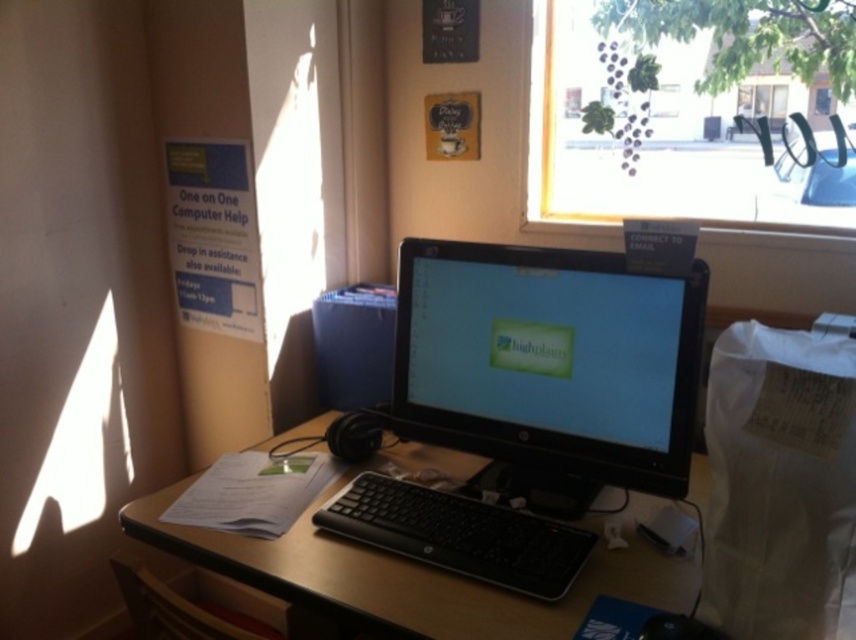
Who is positioned more to the left, black plastic monitor at center or transparent glass window at upper right?

Positioned to the left is black plastic monitor at center.

Describe the element at coordinates (544, 362) in the screenshot. I see `black plastic monitor at center` at that location.

Between point (462, 403) and point (637, 172), which one is positioned behind?

Positioned behind is point (637, 172).

The height and width of the screenshot is (640, 856). Identify the location of black plastic monitor at center. (544, 362).

Where is `transparent glass window at upper right`? transparent glass window at upper right is located at coordinates (658, 138).

Does transparent glass window at upper right have a greater height compared to black plastic computer desk at center?

Correct, transparent glass window at upper right is much taller as black plastic computer desk at center.

Find the location of a particular element. The width and height of the screenshot is (856, 640). transparent glass window at upper right is located at coordinates (658, 138).

Which is above, black plastic monitor at center or satin black monitor at center?

Positioned higher is satin black monitor at center.

Is black plastic monitor at center positioned at the back of satin black monitor at center?

No, black plastic monitor at center is closer to the viewer.

Identify the location of black plastic monitor at center. The image size is (856, 640). (544, 362).